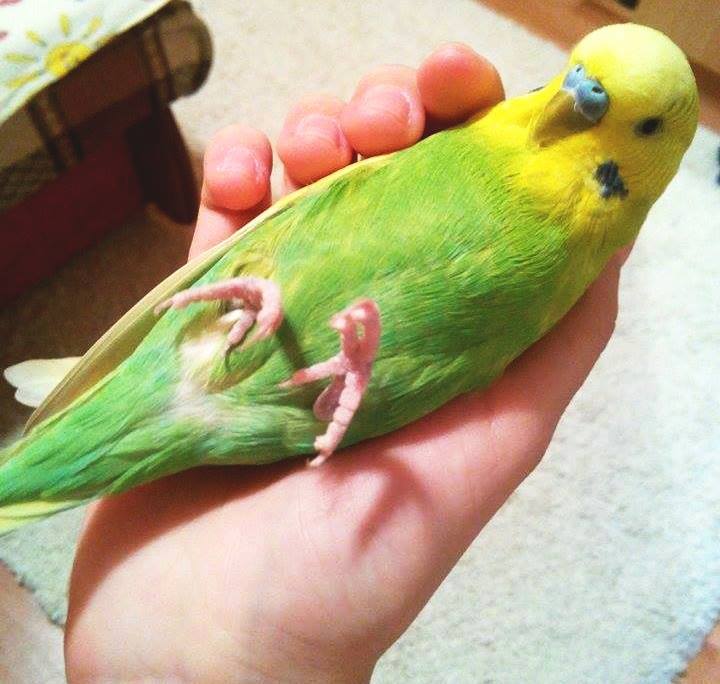
You are a GUI agent. You are given a task and a screenshot of the screen. Output one action in this format:
    pyautogui.click(x=<x>, y=<y>)
    Task: Click on the carpet
    
    Given the screenshot: What is the action you would take?
    pyautogui.click(x=634, y=382)